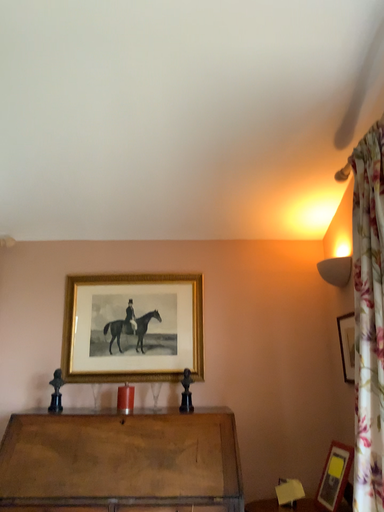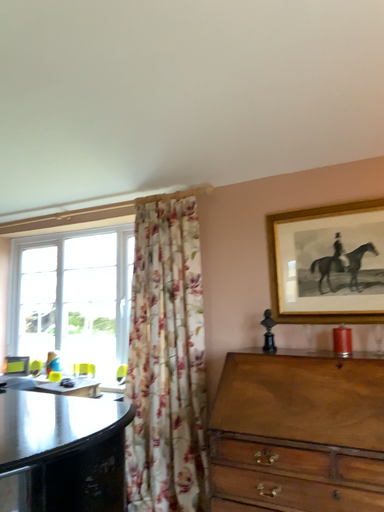
Question: How did the camera likely rotate when shooting the video?

Choices:
 (A) rotated left
 (B) rotated right

Answer: (A)